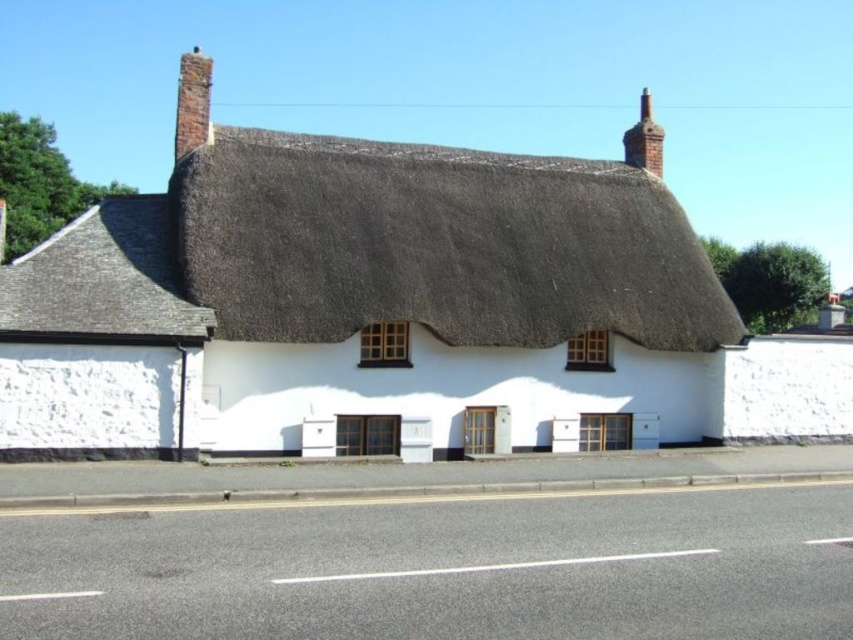
Question: Does white thatched roof cottage at center have a lesser width compared to red brick chimney at upper right?

Choices:
 (A) no
 (B) yes

Answer: (B)

Question: In this image, where is white thatched roof cottage at center located relative to red brick chimney at upper right?

Choices:
 (A) right
 (B) left

Answer: (B)

Question: Is white thatched roof cottage at center thinner than brick chimney at upper left?

Choices:
 (A) yes
 (B) no

Answer: (A)

Question: Which object is positioned farthest from the white thatched roof cottage at center?

Choices:
 (A) brown thatch roof at center
 (B) brick chimney at upper left

Answer: (B)

Question: Estimate the real-world distances between objects in this image. Which object is closer to the brown thatch roof at center?

Choices:
 (A) red brick chimney at upper right
 (B) white thatched roof cottage at center
 (C) brick chimney at upper left

Answer: (B)

Question: Which point appears closest to the camera in this image?

Choices:
 (A) (248, 160)
 (B) (210, 64)
 (C) (74, 371)
 (D) (648, 161)

Answer: (C)